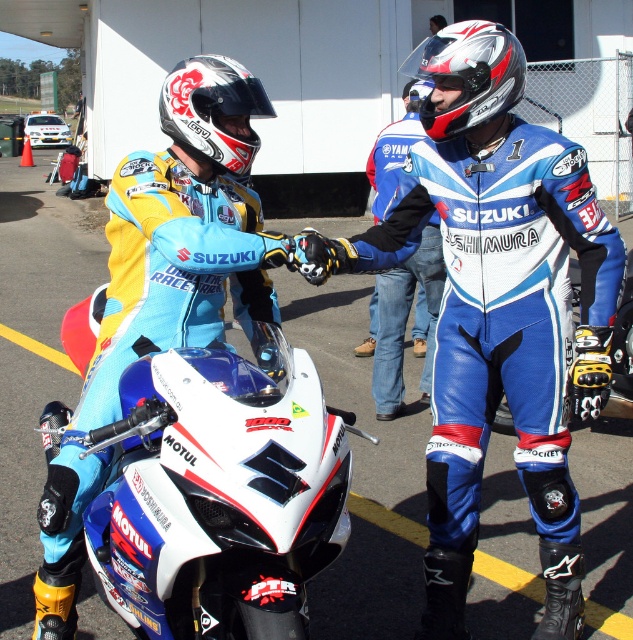
Question: Which of the following is the farthest from the observer?

Choices:
 (A) (501, 102)
 (B) (260, 144)
 (C) (329, 518)
 (D) (546, 280)

Answer: (D)

Question: In this image, where is matte blue suit at center located relative to white glossy helmet at upper center?

Choices:
 (A) below
 (B) above

Answer: (A)

Question: Does blue leather suit at center appear under white glossy helmet at upper center?

Choices:
 (A) no
 (B) yes

Answer: (B)

Question: Which point appears farthest from the camera in this image?

Choices:
 (A) (204, 432)
 (B) (460, 356)
 (C) (232, 77)

Answer: (B)

Question: Can you confirm if matte blue suit at center is positioned below silver/textured helmet at upper center?

Choices:
 (A) yes
 (B) no

Answer: (A)

Question: Among these objects, which one is nearest to the camera?

Choices:
 (A) matte blue suit at center
 (B) silver/textured helmet at upper center
 (C) blue leather suit at center
 (D) white glossy helmet at upper center

Answer: (A)